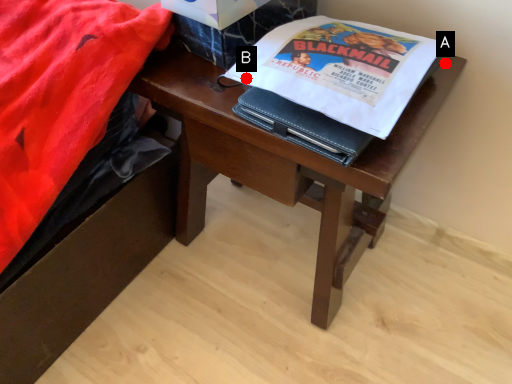
Question: Two points are circled on the image, labeled by A and B beside each circle. Which point is closer to the camera taking this photo?

Choices:
 (A) A is closer
 (B) B is closer

Answer: (B)